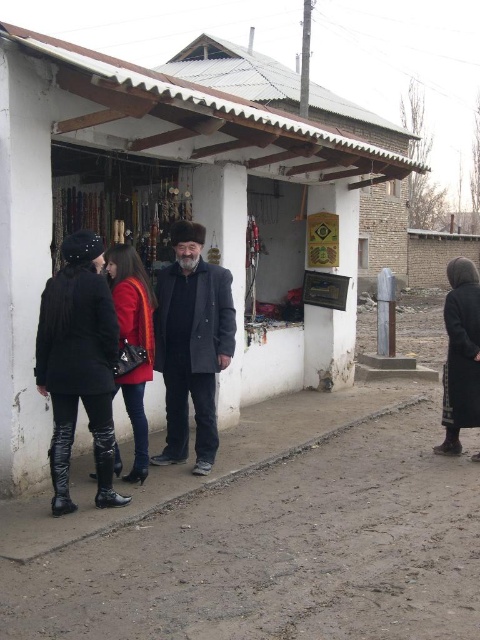
You are standing in front of the rustic storefront and notice two points marked on the wall inside the shop. The first point is at coordinates point (137, 300) and the second is at point (454, 371). Which of these points is closer to your current position?

A: Point (137, 300) is closer to the camera than point (454, 371), so the first point is closer to your current position.

You are a customer entering the rustic storefront and notice two items at the center of the shop. Which item is taller between the white matte hut at center and the dark gray wool coat at center?

The white matte hut at center is much taller than the dark gray wool coat at center according to the description.

You are a customer in the store and want to choose between the dark gray wool coat at center and the dark gray wool coat at right. Which one is wider?

The dark gray wool coat at right is wider than the dark gray wool coat at center.